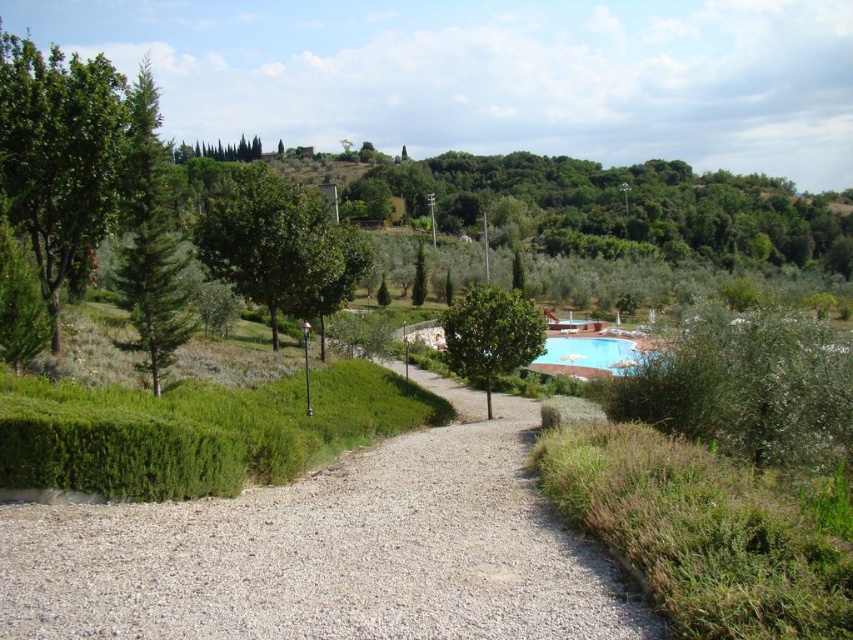
Question: Which object is the farthest from the gray gravel at center?

Choices:
 (A) blue glossy pool at center
 (B) green leafy tree at center
 (C) green textured pine tree at left

Answer: (B)

Question: Which point is farther from the camera taking this photo?

Choices:
 (A) (4, 115)
 (B) (271, 280)

Answer: (B)

Question: Which of the following is the farthest from the observer?

Choices:
 (A) (131, 317)
 (B) (519, 326)

Answer: (B)

Question: Can you confirm if gray gravel at center is thinner than green leafy tree at left?

Choices:
 (A) yes
 (B) no

Answer: (A)

Question: Does green textured pine tree at left lie behind green leafy olive tree at center-right?

Choices:
 (A) yes
 (B) no

Answer: (B)

Question: Is green leafy tree at left positioned at the back of blue glossy pool at center?

Choices:
 (A) yes
 (B) no

Answer: (A)